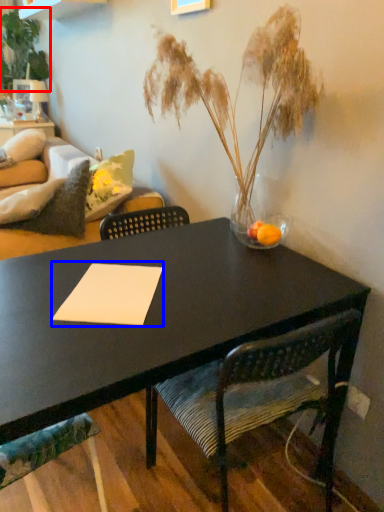
Question: Which object is closer to the camera taking this photo, floral arrangement (highlighted by a red box) or notepad (highlighted by a blue box)?

Choices:
 (A) floral arrangement
 (B) notepad

Answer: (B)